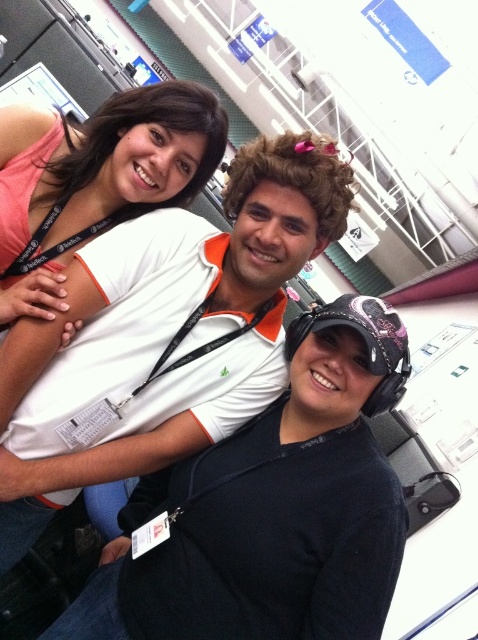
You are at an event and need to find the person wearing the matte pink tank top at upper left. Which direction should you look relative to the black matte cap at center?

The matte pink tank top at upper left is located to the left of the black matte cap at center, so you should look to the left side of the black matte cap at center to find it.

You are a photographer at an event and need to capture a clear photo of both the black matte cap at center and the white matte polo shirt at center. The camera you are using has a focus range of 10 inches. Will both objects be in focus if they are 10.80 inches apart?

The black matte cap at center and white matte polo shirt at center are 10.80 inches apart. Since the camera has a focus range of 10 inches, the distance between them exceeds the focus range. Therefore, both objects may not be in focus simultaneously.

You are a photographer at the event and need to adjust the lighting to ensure both the black matte cap at center and the white matte polo shirt at center are clearly visible. Given their positions, which object might require more careful lighting adjustment to avoid shadows?

The black matte cap at center is positioned under the white matte polo shirt at center. Since the cap is underneath, it may be in a shadowed area, requiring more careful lighting adjustment to ensure visibility.